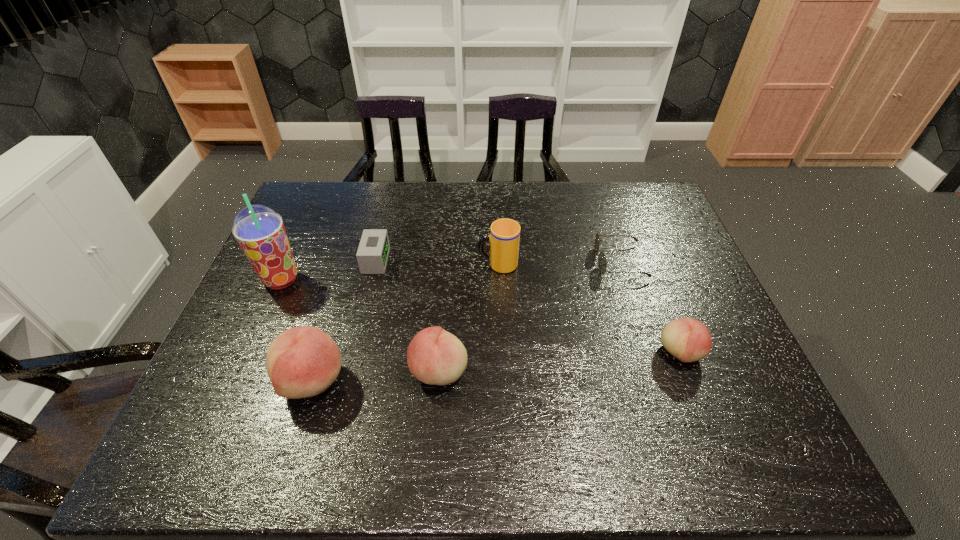
Locate an element on the screen. The height and width of the screenshot is (540, 960). location for an additional peach to make spacing equal is located at coordinates (562, 361).